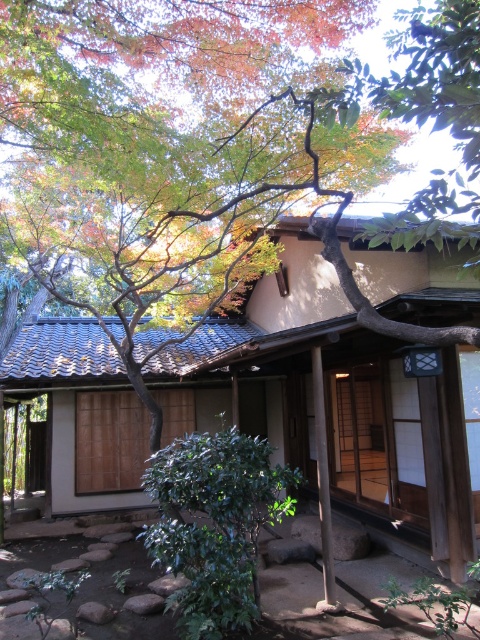
The height and width of the screenshot is (640, 480). Describe the element at coordinates (336, 404) in the screenshot. I see `beige wooden hut at center` at that location.

Consider the image. Is beige wooden hut at center closer to the viewer compared to green leafy bush at center?

Yes, beige wooden hut at center is closer to the viewer.

Is point (48, 388) less distant than point (203, 496)?

No, (48, 388) is behind (203, 496).

You are a GUI agent. You are given a task and a screenshot of the screen. Output one action in this format:
    pyautogui.click(x=<x>, y=<y>)
    Task: Click on the beige wooden hut at center
    
    Given the screenshot: What is the action you would take?
    pyautogui.click(x=336, y=404)